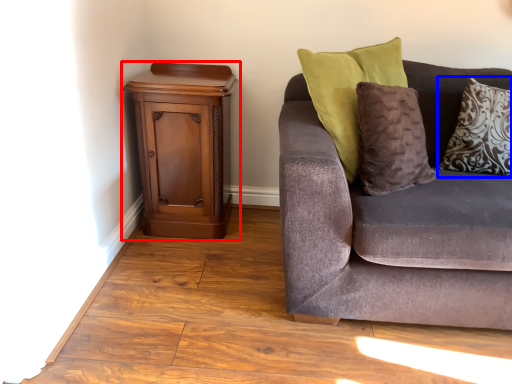
Question: Among these objects, which one is farthest to the camera, nightstand (highlighted by a red box) or pillow (highlighted by a blue box)?

Choices:
 (A) nightstand
 (B) pillow

Answer: (A)